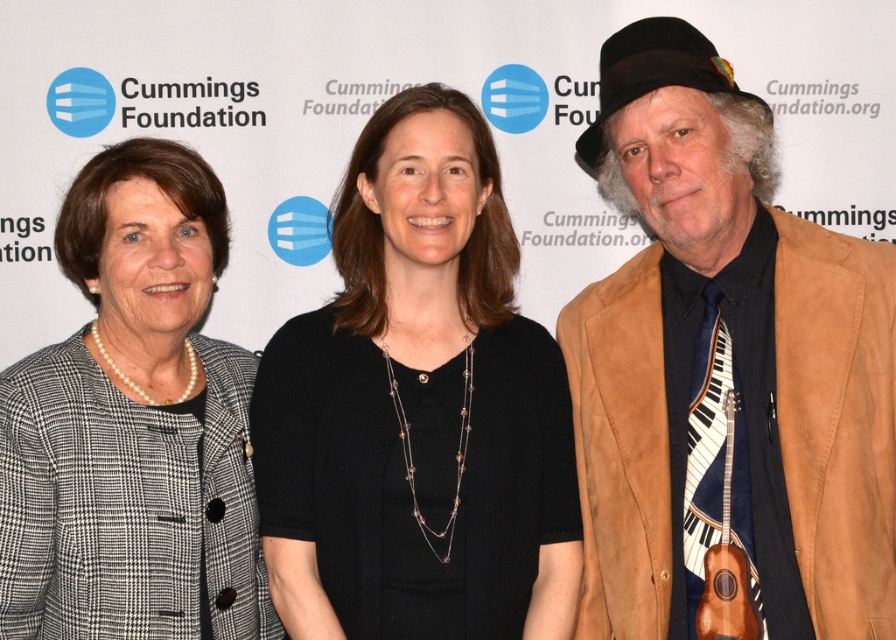
Question: Does suede jacket at center lie in front of plaid wool blazer at left?

Choices:
 (A) no
 (B) yes

Answer: (B)

Question: Based on their relative distances, which object is farther from the plaid wool blazer at left?

Choices:
 (A) suede jacket at center
 (B) black matte sweater at center

Answer: (A)

Question: Does suede jacket at center have a greater width compared to black matte sweater at center?

Choices:
 (A) yes
 (B) no

Answer: (B)

Question: Which object is positioned farthest from the black matte sweater at center?

Choices:
 (A) plaid wool blazer at left
 (B) suede jacket at center

Answer: (B)

Question: Which of the following is the closest to the observer?

Choices:
 (A) suede jacket at center
 (B) black matte sweater at center
 (C) plaid wool blazer at left

Answer: (A)

Question: Is suede jacket at center thinner than black matte sweater at center?

Choices:
 (A) no
 (B) yes

Answer: (B)